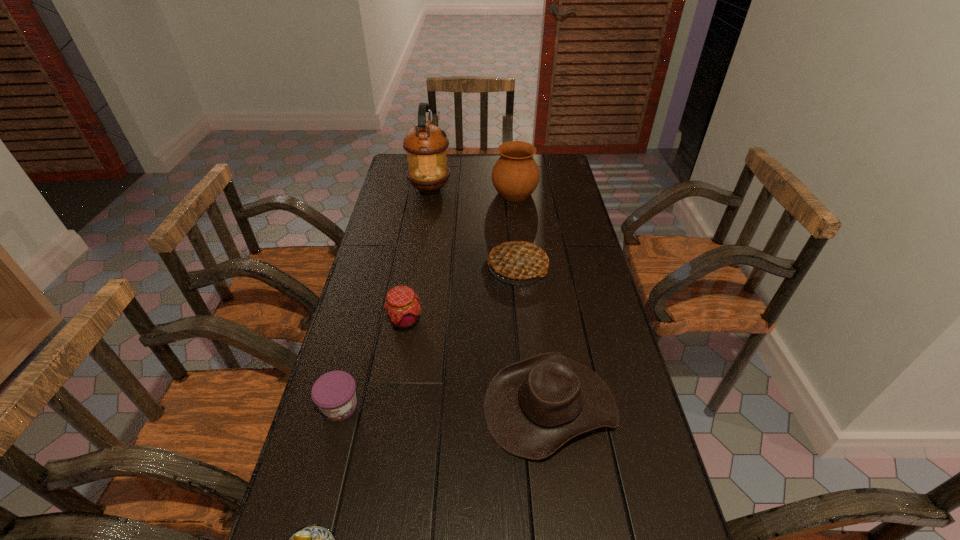
Identify the location of vacant area located 0.200m on the back of the second tallest object. Image resolution: width=960 pixels, height=540 pixels. (511, 159).

Identify the location of free location located on the left of the pie. This screenshot has width=960, height=540. (402, 267).

Find the location of a particular element. vacant position located on the back of the right jam is located at coordinates (411, 288).

You are a GUI agent. You are given a task and a screenshot of the screen. Output one action in this format:
    pyautogui.click(x=<x>, y=<y>)
    Task: Click on the blank area located on the left of the cowboy hat
    The height and width of the screenshot is (540, 960).
    Given the screenshot: What is the action you would take?
    pyautogui.click(x=364, y=406)

The height and width of the screenshot is (540, 960). I want to click on free spot located on the front label of the sixth tallest object, so click(322, 477).

Find the location of a particular element. The width and height of the screenshot is (960, 540). object positioned at the far edge is located at coordinates (425, 144).

Image resolution: width=960 pixels, height=540 pixels. What are the coordinates of `oil lamp present at the left edge` in the screenshot? It's located at (425, 144).

Where is `pottery located at the right edge`? The image size is (960, 540). pottery located at the right edge is located at coordinates (515, 175).

Where is `pie positioned at the right edge`? This screenshot has width=960, height=540. pie positioned at the right edge is located at coordinates (519, 260).

At what (x,y) coordinates should I click in order to perform the action: click on cowboy hat positioned at the right edge. Please return your answer as a coordinate pair (x, y). This screenshot has height=540, width=960. Looking at the image, I should click on click(532, 407).